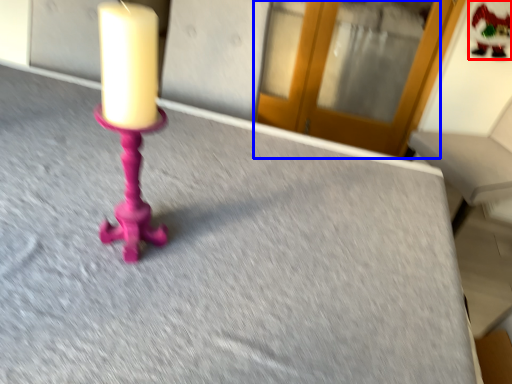
Question: Which object is further to the camera taking this photo, santa claus (highlighted by a red box) or glass door (highlighted by a blue box)?

Choices:
 (A) santa claus
 (B) glass door

Answer: (B)